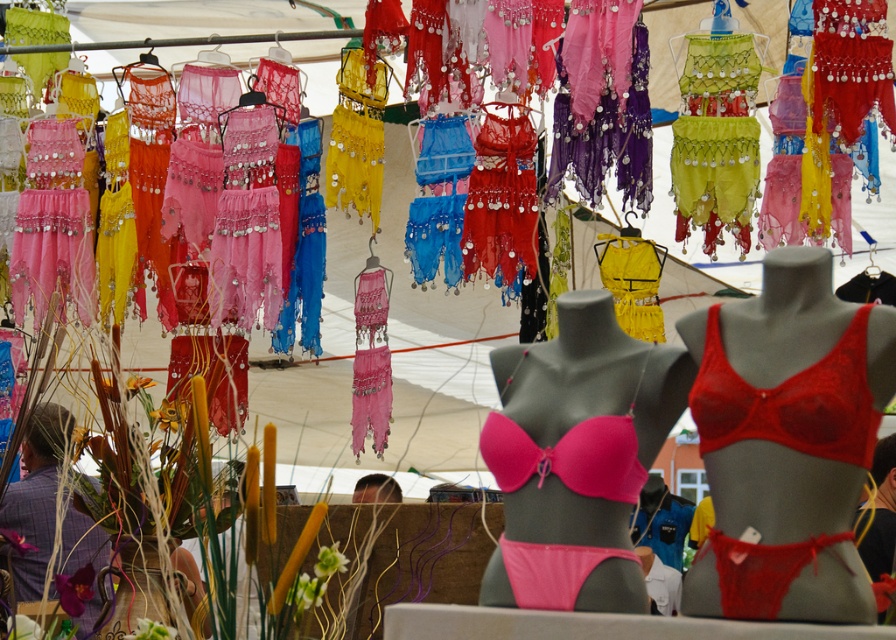
Does lace red bra at center have a greater width compared to red lace bikini top at center?

Correct, the width of lace red bra at center exceeds that of red lace bikini top at center.

Is lace red bra at center bigger than red lace bikini top at center?

Correct, lace red bra at center is larger in size than red lace bikini top at center.

Between point (768, 483) and point (860, 422), which one is positioned in front?

Point (860, 422) is in front.

Locate an element on the screen. lace red bra at center is located at coordinates (786, 442).

Can you confirm if lace red bra at center is taller than pink matte bikini at center?

Yes, lace red bra at center is taller than pink matte bikini at center.

How distant is lace red bra at center from pink matte bikini at center?

12.36 centimeters

Between point (746, 547) and point (532, 522), which one is positioned in front?

Point (746, 547)

The width and height of the screenshot is (896, 640). What are the coordinates of `lace red bra at center` in the screenshot? It's located at (786, 442).

Consider the image. Who is more distant from viewer, (554, 376) or (843, 340)?

Positioned behind is point (554, 376).

Between pink matte bikini at center and red lace bikini top at center, which one is positioned lower?

pink matte bikini at center

Does point (662, 419) come closer to viewer compared to point (700, 392)?

No, it is behind (700, 392).

The height and width of the screenshot is (640, 896). I want to click on pink matte bikini at center, so click(x=576, y=458).